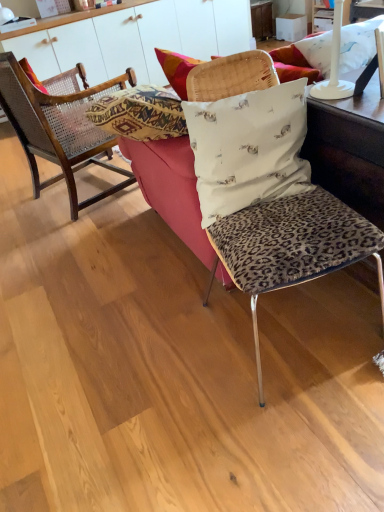
Question: From their relative heights in the image, would you say white fabric pillow with small animal prints at center, the 2th pillow positioned from the back, is taller or shorter than woven cane pillow at left, positioned as the second pillow in right-to-left order?

Choices:
 (A) tall
 (B) short

Answer: (B)

Question: Is white fabric pillow with small animal prints at center, marked as the 1th pillow in a bottom-to-top arrangement, spatially inside woven cane pillow at left, positioned as the second pillow in right-to-left order, or outside of it?

Choices:
 (A) inside
 (B) outside

Answer: (B)

Question: Which of these objects is positioned farthest from the white glossy cabinet at upper center?

Choices:
 (A) woven cane pillow at left, positioned as the 2th pillow in front-to-back order
 (B) leopard print fabric couch at center
 (C) leopard print cushion at center, the second chair from the left
 (D) wooden cane chair at left, the first chair viewed from the back
 (E) white fabric pillow with small animal prints at center, which is counted as the first pillow, starting from the front

Answer: (C)

Question: Which object is positioned farthest from the woven cane pillow at left, positioned as the second pillow in right-to-left order?

Choices:
 (A) wooden cane chair at left, the second chair when ordered from front to back
 (B) leopard print cushion at center, the second chair from the left
 (C) white glossy cabinet at upper center
 (D) white fabric pillow with small animal prints at center, the second pillow when ordered from left to right
 (E) leopard print fabric couch at center

Answer: (B)